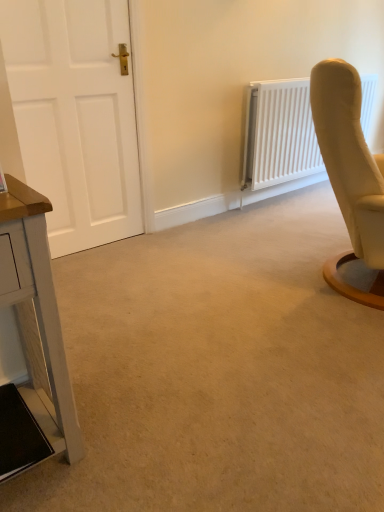
Where is `white matte radiator at upper right`? This screenshot has width=384, height=512. white matte radiator at upper right is located at coordinates (279, 134).

Describe the element at coordinates (33, 340) in the screenshot. The height and width of the screenshot is (512, 384). I see `white painted wood table at left` at that location.

Identify the location of white matte radiator at upper right. The height and width of the screenshot is (512, 384). (279, 134).

Is white painted wood table at left far away from white matte radiator at upper right?

Yes, white painted wood table at left and white matte radiator at upper right are located far from each other.

Is white painted wood table at left at the left side of white matte radiator at upper right?

Indeed, white painted wood table at left is positioned on the left side of white matte radiator at upper right.

Considering the sizes of objects white painted wood table at left and white matte radiator at upper right in the image provided, who is shorter, white painted wood table at left or white matte radiator at upper right?

With less height is white painted wood table at left.

Does white painted wood table at left have a larger size compared to white matte radiator at upper right?

Incorrect, white painted wood table at left is not larger than white matte radiator at upper right.

Would you consider white matte radiator at upper right to be distant from white painted wood table at left?

Yes, white matte radiator at upper right and white painted wood table at left are located far from each other.

Is white matte radiator at upper right to the left of white painted wood table at left from the viewer's perspective?

No, white matte radiator at upper right is not to the left of white painted wood table at left.

From the image's perspective, between white matte radiator at upper right and white painted wood table at left, who is located below?

From the image's view, white painted wood table at left is below.

In order to click on door that is behind the white painted wood table at left in this screenshot , I will do `click(75, 116)`.

Considering the relative positions of white matte door at left and white painted wood table at left in the image provided, is white matte door at left to the left of white painted wood table at left from the viewer's perspective?

Correct, you'll find white matte door at left to the left of white painted wood table at left.

Would you consider white matte door at left to be distant from white painted wood table at left?

Yes, white matte door at left is far from white painted wood table at left.

This screenshot has width=384, height=512. There is a white painted wood table at left. Identify the location of door above it (from a real-world perspective). (75, 116).

Which object is thinner, white painted wood table at left or white matte door at left?

white matte door at left.

Does white painted wood table at left have a larger size compared to white matte door at left?

Yes, white painted wood table at left is bigger than white matte door at left.

Is white painted wood table at left placed right next to white matte door at left?

white painted wood table at left is not next to white matte door at left, and they're not touching.

Could you tell me if white matte radiator at upper right is turned towards white matte door at left?

No, white matte radiator at upper right is not oriented towards white matte door at left.

Which is more to the right, white matte radiator at upper right or white matte door at left?

Positioned to the right is white matte radiator at upper right.

Is white matte door at left surrounded by white matte radiator at upper right?

No, white matte door at left is not a part of white matte radiator at upper right.

What's the angular difference between white matte radiator at upper right and white matte door at left's facing directions?

white matte radiator at upper right and white matte door at left are facing 1.1 degrees away from each other.

What's the angular difference between white matte door at left and white matte radiator at upper right's facing directions?

1.1 degrees separate the facing orientations of white matte door at left and white matte radiator at upper right.

Is white matte door at left facing away from white matte radiator at upper right?

No.

Do you think white matte door at left is within white matte radiator at upper right, or outside of it?

white matte door at left is not enclosed by white matte radiator at upper right.

In terms of height, does white matte door at left look taller or shorter compared to white matte radiator at upper right?

white matte door at left is taller than white matte radiator at upper right.

Find the location of a particular element. This screenshot has width=384, height=512. table that appears on the left of white matte radiator at upper right is located at coordinates (33, 340).

Find the location of `table in front of the white matte radiator at upper right`. table in front of the white matte radiator at upper right is located at coordinates (33, 340).

Considering their positions, is white matte radiator at upper right positioned further to white painted wood table at left than white matte door at left?

The object further to white painted wood table at left is white matte radiator at upper right.

When comparing their distances from white matte radiator at upper right, does white matte door at left or white painted wood table at left seem closer?

The object closer to white matte radiator at upper right is white matte door at left.

From the image, which object appears to be nearer to white matte door at left, white painted wood table at left or white matte radiator at upper right?

white matte radiator at upper right.

From the image, which object appears to be nearer to white painted wood table at left, white matte door at left or white matte radiator at upper right?

The object closer to white painted wood table at left is white matte door at left.

Based on the photo, based on their spatial positions, is white painted wood table at left or white matte door at left closer to white matte radiator at upper right?

Among the two, white matte door at left is located nearer to white matte radiator at upper right.

From the image, which object appears to be farther from white matte door at left, white matte radiator at upper right or white painted wood table at left?

white painted wood table at left lies further to white matte door at left than the other object.

Identify the location of door between white painted wood table at left and white matte radiator at upper right along the z-axis. (75, 116).